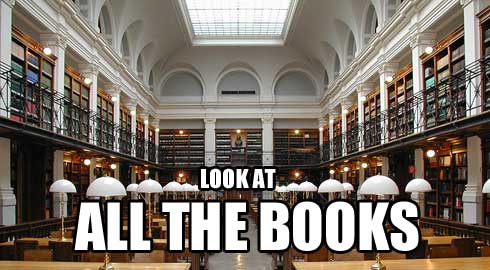
You are a GUI agent. You are given a task and a screenshot of the screen. Output one action in this format:
    pyautogui.click(x=<x>, y=<y>)
    Task: Click on the white dome lamp tops on right side
    This screenshot has height=270, width=490.
    Given the screenshot: What is the action you would take?
    pyautogui.click(x=282, y=187), pyautogui.click(x=289, y=189), pyautogui.click(x=304, y=189), pyautogui.click(x=324, y=184), pyautogui.click(x=350, y=187), pyautogui.click(x=374, y=184), pyautogui.click(x=417, y=184)